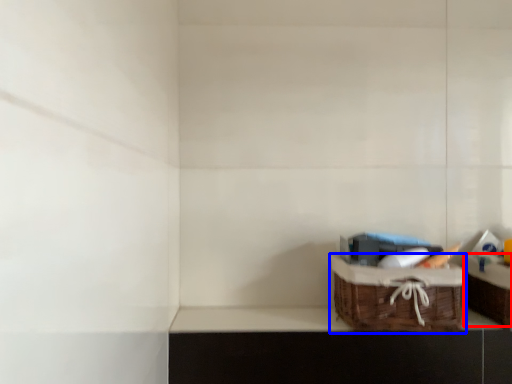
Question: Among these objects, which one is farthest to the camera, cabinetry (highlighted by a red box) or picnic basket (highlighted by a blue box)?

Choices:
 (A) cabinetry
 (B) picnic basket

Answer: (A)